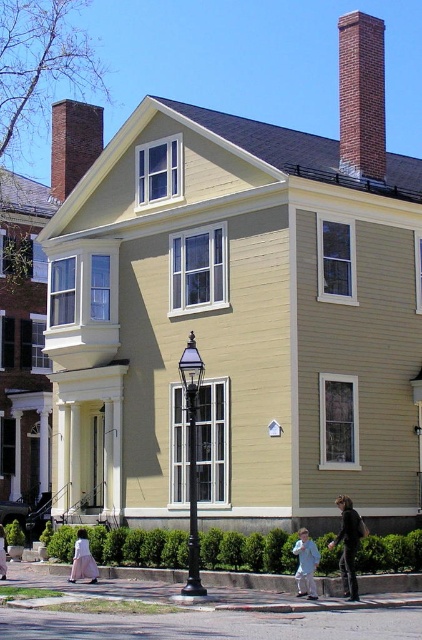
You are a delivery person approaching the house and see the dark gray jacket at lower right and the light blue fabric child at lower center. Which object is closer to the front door of the house?

The dark gray jacket at lower right is taller than the light blue fabric child at lower center, but this does not necessarily indicate their distance from the front door. To determine which is closer, we need more information about their positions relative to the door.

You are standing on the sidewalk in front of the house and see the dark gray jacket at lower right and the light blue fabric child at lower center. Which object is positioned higher relative to the other?

The dark gray jacket at lower right is located above the light blue fabric child at lower center, so it is positioned higher.